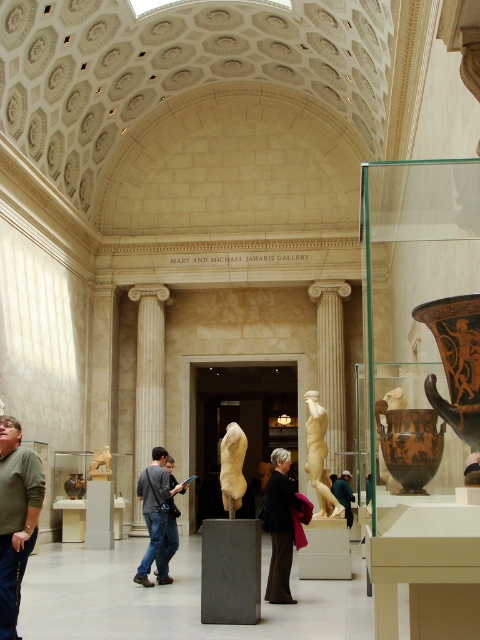
Question: Is the position of dark brown leather jacket at center more distant than that of matte white statue at center?

Choices:
 (A) no
 (B) yes

Answer: (A)

Question: Among these points, which one is farthest from the camera?

Choices:
 (A) (164, 536)
 (B) (317, 481)

Answer: (B)

Question: Considering the real-world distances, which object is closest to the dark brown leather jacket at center?

Choices:
 (A) white marble column at center
 (B) green matte sweater at lower left
 (C) matte white statue at center
 (D) brown glossy vase at right

Answer: (C)

Question: Does white marble column at center have a lesser width compared to matte white statue at center?

Choices:
 (A) yes
 (B) no

Answer: (B)

Question: Which of the following is the closest to the observer?

Choices:
 (A) (225, 474)
 (B) (307, 458)

Answer: (A)

Question: From the image, what is the correct spatial relationship of dark gray jeans at center in relation to beige marble torso at center?

Choices:
 (A) below
 (B) above

Answer: (B)